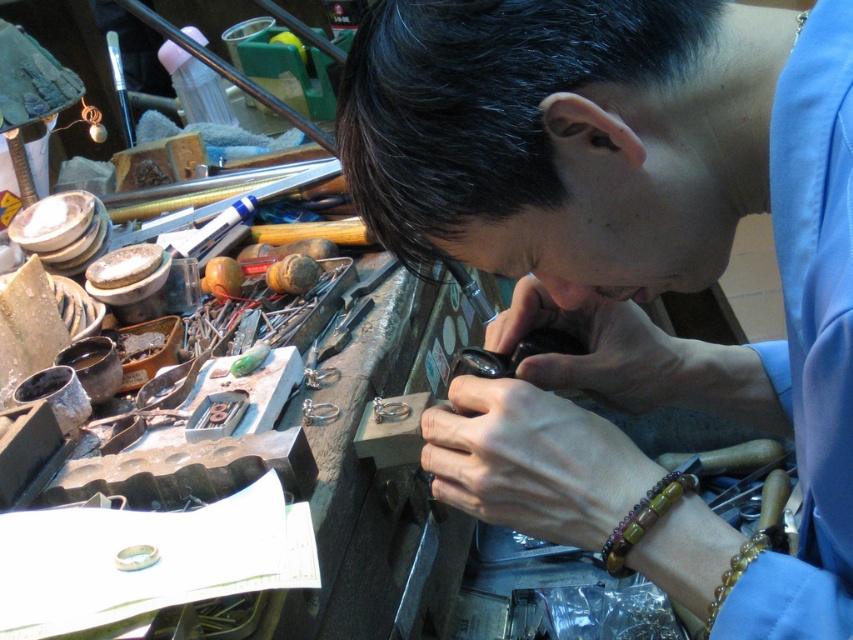
Question: Among these objects, which one is nearest to the camera?

Choices:
 (A) smooth skin hand at center
 (B) multicolored wood beads at lower right
 (C) matte black ring at center
 (D) matte gold ring at center

Answer: (D)

Question: Is smooth skin hand at center positioned at the back of brown polished bracelet at lower right?

Choices:
 (A) no
 (B) yes

Answer: (B)

Question: Which point appears closest to the camera in this image?

Choices:
 (A) (677, 481)
 (B) (466, 104)
 (C) (561, 381)
 (D) (740, 566)

Answer: (D)

Question: Is matte black ring at center wider than brown polished bracelet at lower right?

Choices:
 (A) no
 (B) yes

Answer: (B)

Question: Does matte gold ring at center appear on the right side of brown polished bracelet at lower right?

Choices:
 (A) no
 (B) yes

Answer: (A)

Question: Which is farther from the matte gold ring at center?

Choices:
 (A) smooth skin hand at center
 (B) multicolored wood beads at lower right
 (C) brown polished bracelet at lower right

Answer: (C)